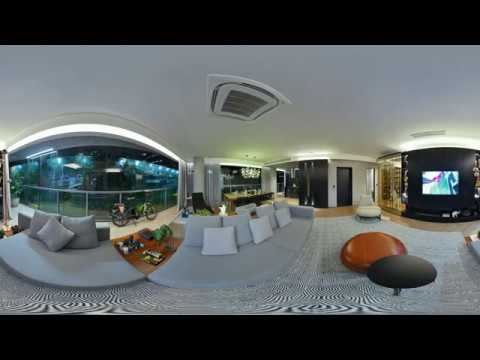
Identify the location of floor. (335, 279).